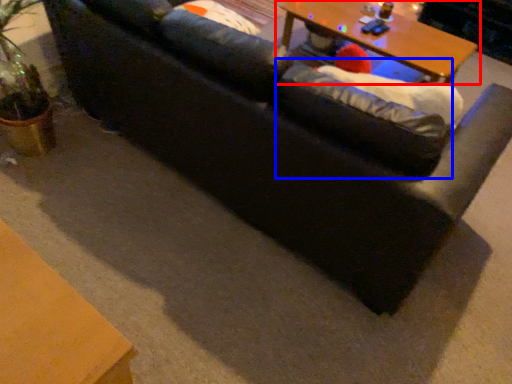
Question: Which object appears closest to the camera in this image, table (highlighted by a red box) or bean bag chair (highlighted by a blue box)?

Choices:
 (A) table
 (B) bean bag chair

Answer: (B)